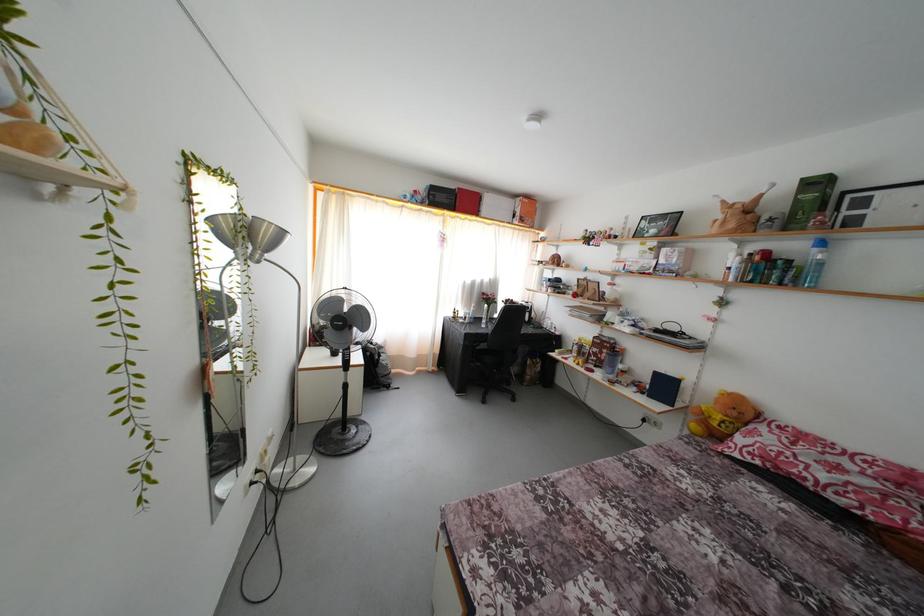
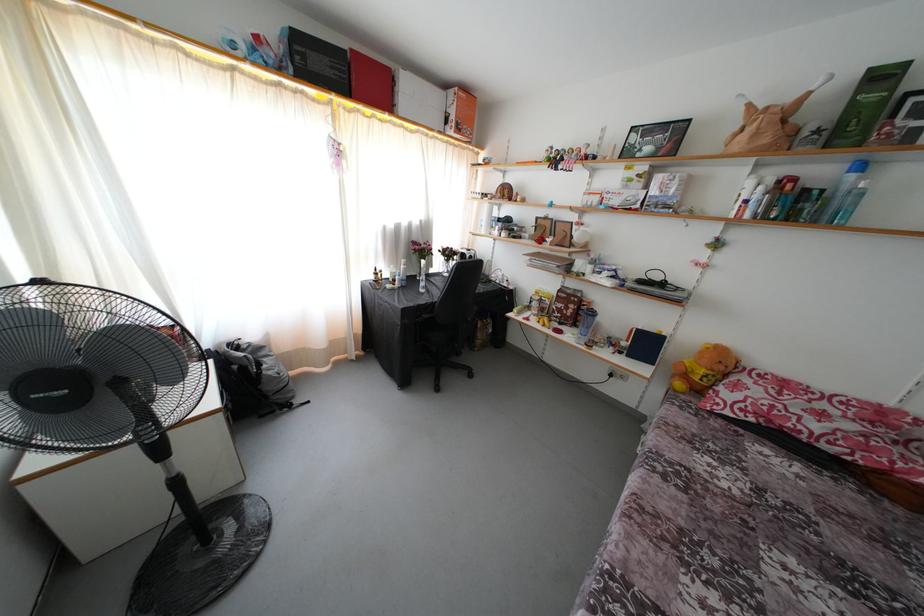
Locate, in the second image, the point that corresponds to the point at 368,374 in the first image.

(225, 421)